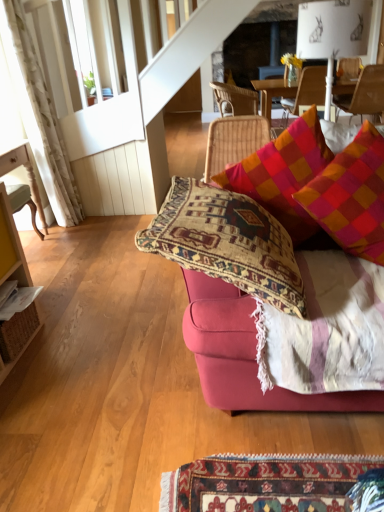
Question: Is wooden chair at upper right, arranged as the 3th chair when viewed from the left, shorter than multicolored woven cushion at upper right, acting as the 2th pillow starting from the right?

Choices:
 (A) yes
 (B) no

Answer: (A)

Question: Does wooden chair at upper right, marked as the 2th chair in a right-to-left arrangement, appear on the right side of multicolored woven cushion at upper right, acting as the 2th pillow starting from the right?

Choices:
 (A) yes
 (B) no

Answer: (A)

Question: Is wooden chair at upper right, which is counted as the third chair, starting from the front, looking in the opposite direction of multicolored woven cushion at upper right, which is the first pillow from left to right?

Choices:
 (A) no
 (B) yes

Answer: (B)

Question: Is wooden chair at upper right, marked as the 2th chair in a right-to-left arrangement, bigger than multicolored woven cushion at upper right, which is the first pillow from left to right?

Choices:
 (A) yes
 (B) no

Answer: (A)

Question: Is wooden chair at upper right, arranged as the 3th chair when viewed from the left, positioned beyond the bounds of multicolored woven cushion at upper right, which is the first pillow from left to right?

Choices:
 (A) no
 (B) yes

Answer: (B)

Question: Looking at their shapes, would you say plaid fabric pillow at upper right, positioned as the 1th pillow in right-to-left order, is wider or thinner than rattan chair at upper center, marked as the fourth chair in a front-to-back arrangement?

Choices:
 (A) thin
 (B) wide

Answer: (A)

Question: Visually, is plaid fabric pillow at upper right, the 2th pillow positioned from the left, positioned to the left or to the right of rattan chair at upper center, positioned as the 1th chair in back-to-front order?

Choices:
 (A) right
 (B) left

Answer: (A)

Question: Is plaid fabric pillow at upper right, the 2th pillow positioned from the left, bigger or smaller than rattan chair at upper center, the 3th chair viewed from the right?

Choices:
 (A) small
 (B) big

Answer: (A)

Question: From a real-world perspective, is plaid fabric pillow at upper right, the 2th pillow positioned from the left, positioned above or below rattan chair at upper center, the 3th chair viewed from the right?

Choices:
 (A) above
 (B) below

Answer: (A)

Question: From the image's perspective, is wooden chair at upper right, which is counted as the third chair, starting from the front, located above or below wooden chair at upper right, which is the fourth chair in left-to-right order?

Choices:
 (A) above
 (B) below

Answer: (A)

Question: In terms of size, does wooden chair at upper right, which is counted as the third chair, starting from the front, appear bigger or smaller than wooden chair at upper right, which is the fourth chair in left-to-right order?

Choices:
 (A) big
 (B) small

Answer: (A)

Question: Considering the relative positions of wooden chair at upper right, which is counted as the third chair, starting from the front, and wooden chair at upper right, which is the first chair from right to left, in the image provided, is wooden chair at upper right, which is counted as the third chair, starting from the front, to the left or to the right of wooden chair at upper right, which is the first chair from right to left,?

Choices:
 (A) right
 (B) left

Answer: (B)

Question: From a real-world perspective, is wooden chair at upper right, arranged as the 3th chair when viewed from the left, physically located above or below wooden chair at upper right, which is the fourth chair in left-to-right order?

Choices:
 (A) below
 (B) above

Answer: (B)

Question: Looking at the image, does velvet pink couch at center seem bigger or smaller compared to plaid fabric pillow at upper right, positioned as the 1th pillow in right-to-left order?

Choices:
 (A) big
 (B) small

Answer: (A)

Question: In terms of height, does velvet pink couch at center look taller or shorter compared to plaid fabric pillow at upper right, positioned as the 1th pillow in right-to-left order?

Choices:
 (A) short
 (B) tall

Answer: (B)